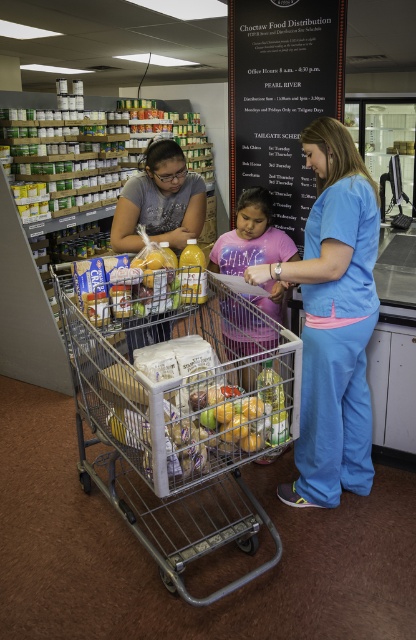
You are a volunteer at the Choctaw Food Distribution site. You need to determine if the pink cotton shirt at center can be placed on top of the metallic silver trolley at center without falling off. Based on their heights, can this be done?

The metallic silver trolley at center is taller than the pink cotton shirt at center. Since the trolley is taller, placing the shirt on top would be possible as it would have a stable surface to rest on without falling off.

You are standing at the point marked by the coordinates point (222,392). You want to pick up a shopping cart that is 3 feet wide. Is there enough space between you and the nearest obstacle to safely maneuver the cart without hitting anything?

The distance between you and the nearest obstacle is 5.94 feet. Since the shopping cart is 3 feet wide, there is sufficient space to maneuver safely as 5.94 feet is greater than 3 feet.

You are a volunteer at the Choctaw Food Distribution site and need to hand a package to the person wearing the pink cotton shirt at center. The package is too large to carry around the metallic silver trolley at center. Can you reach them directly without moving the trolley?

The metallic silver trolley at center is closer to the viewer than the pink cotton shirt at center, so the trolley is blocking the direct path. You would need to move the trolley to reach the person wearing the pink cotton shirt at center.